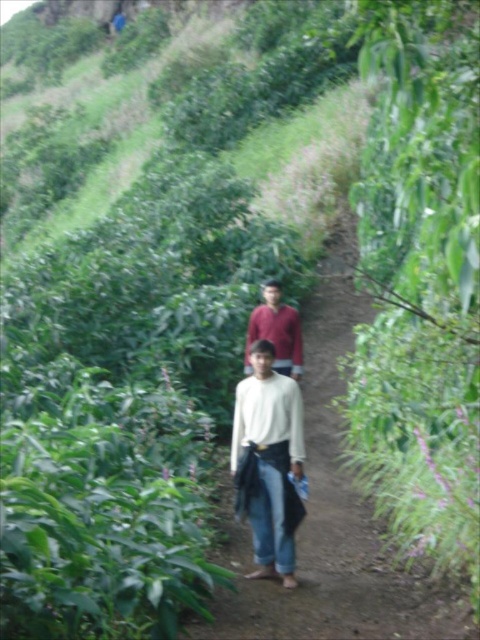
You are a photographer standing at the top of the slope observing the two people walking on the path. You want to take a photo that includes both individuals clearly. Since the white matte shirt at center and the matte red shirt at center are at different heights, which one might appear larger in the photo?

The white matte shirt at center would appear larger in the photo because it is taller than the matte red shirt at center.

You are a hiker trying to decide which item to grab first from the ground near the path. You see the white fabric at center and the white matte shirt at center. Which one is higher up?

The white fabric at center is taller than white matte shirt at center, so you should grab the white fabric at center first since it is higher up.